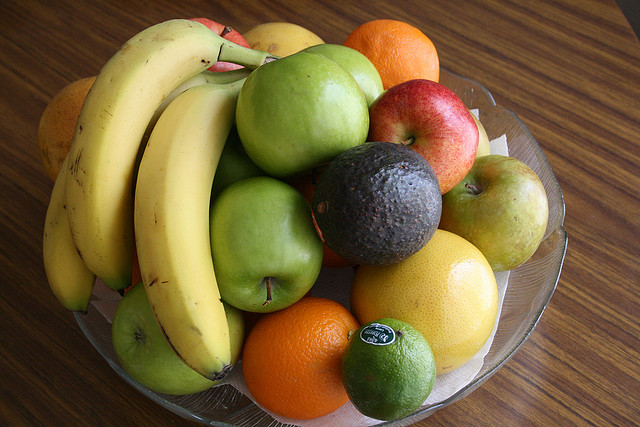
Identify the location of clear bowl. (518, 134).